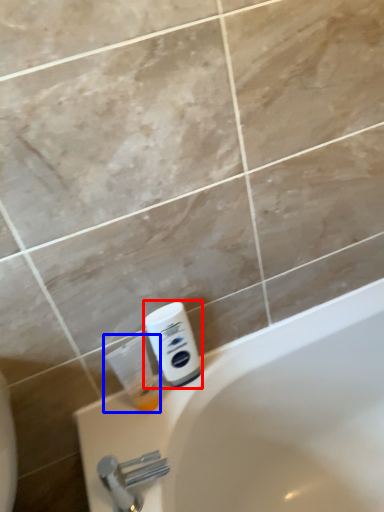
Question: Which of the following is the farthest to the observer, shaving cream (highlighted by a red box) or cleaning product (highlighted by a blue box)?

Choices:
 (A) shaving cream
 (B) cleaning product

Answer: (A)